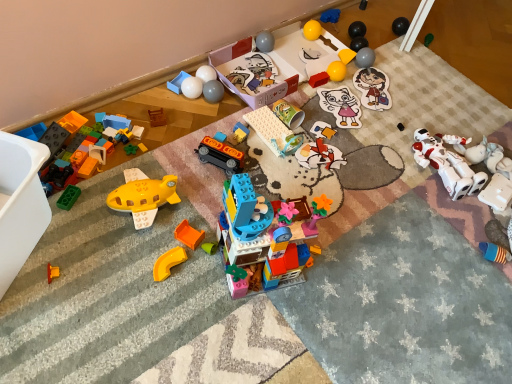
Question: Which direction should I rotate to face blue rubber glove at upper center, positioned as the 18th toy in left-to-right order, — up or down?

Choices:
 (A) down
 (B) up

Answer: (B)

Question: Can we say matte cardboard puzzle piece at center, arranged as the 15th toy when viewed from the left, lies outside matte white cat at center, which is the tenth toy from right to left?

Choices:
 (A) yes
 (B) no

Answer: (A)

Question: From a real-world perspective, is matte cardboard puzzle piece at center, which is counted as the 12th toy, starting from the right, on matte white cat at center, which is the tenth toy from right to left?

Choices:
 (A) no
 (B) yes

Answer: (A)

Question: From the image's perspective, would you say matte cardboard puzzle piece at center, which is counted as the 12th toy, starting from the right, is positioned over matte white cat at center, placed as the seventeenth toy when sorted from left to right?

Choices:
 (A) yes
 (B) no

Answer: (B)

Question: Does matte cardboard puzzle piece at center, arranged as the 15th toy when viewed from the left, come in front of matte white cat at center, which is the tenth toy from right to left?

Choices:
 (A) yes
 (B) no

Answer: (A)

Question: Is there a large distance between matte cardboard puzzle piece at center, which is counted as the 12th toy, starting from the right, and matte white cat at center, placed as the seventeenth toy when sorted from left to right?

Choices:
 (A) yes
 (B) no

Answer: (B)

Question: Is matte cardboard puzzle piece at center, arranged as the 15th toy when viewed from the left, touching matte white cat at center, which is the tenth toy from right to left?

Choices:
 (A) yes
 (B) no

Answer: (B)

Question: Is matte plastic train at center, which is the 11th toy in left-to-right order, smaller than white glossy balls at upper center, marked as the twentieth toy in a right-to-left arrangement?

Choices:
 (A) no
 (B) yes

Answer: (B)

Question: Is matte plastic train at center, which is the 11th toy in left-to-right order, bigger than white glossy balls at upper center, marked as the twentieth toy in a right-to-left arrangement?

Choices:
 (A) no
 (B) yes

Answer: (A)

Question: From a real-world perspective, is matte plastic train at center, the sixteenth toy when ordered from right to left, on white glossy balls at upper center, marked as the twentieth toy in a right-to-left arrangement?

Choices:
 (A) no
 (B) yes

Answer: (A)

Question: Would you say matte plastic train at center, the sixteenth toy when ordered from right to left, is outside white glossy balls at upper center, which is the seventh toy in left-to-right order?

Choices:
 (A) no
 (B) yes

Answer: (B)

Question: Does matte plastic train at center, which is the 11th toy in left-to-right order, have a lesser width compared to white glossy balls at upper center, marked as the twentieth toy in a right-to-left arrangement?

Choices:
 (A) no
 (B) yes

Answer: (B)

Question: Considering the relative positions of matte plastic train at center, which is the 11th toy in left-to-right order, and white glossy balls at upper center, which is the seventh toy in left-to-right order, in the image provided, is matte plastic train at center, which is the 11th toy in left-to-right order, to the right of white glossy balls at upper center, which is the seventh toy in left-to-right order, from the viewer's perspective?

Choices:
 (A) no
 (B) yes

Answer: (B)

Question: From the image's perspective, is blue rubber glove at upper center, positioned as the 18th toy in left-to-right order, beneath matte plastic cup at center, positioned as the fourteenth toy in right-to-left order?

Choices:
 (A) yes
 (B) no

Answer: (B)